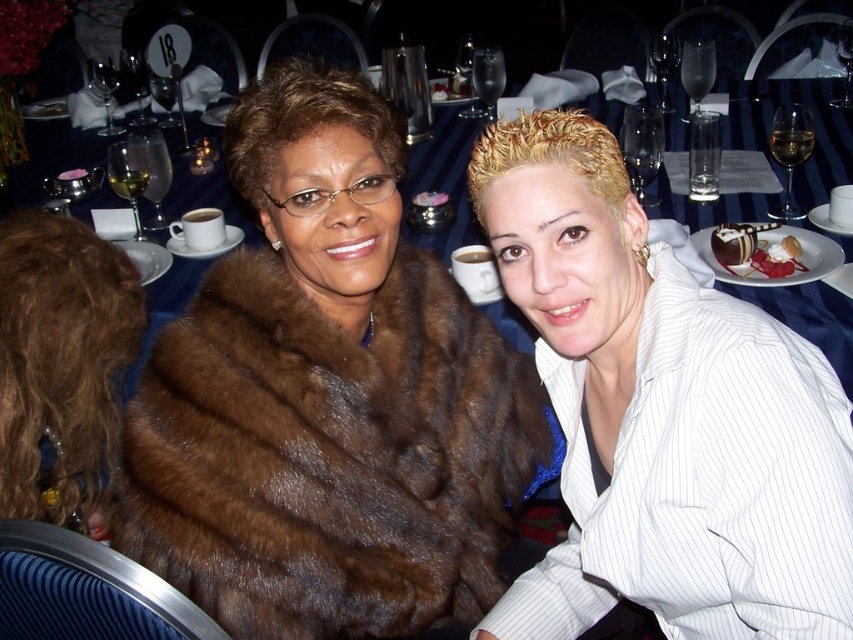
You are a photographer at the event and want to capture a photo that includes both the point at (711,248) and the point at (468,83). Which point should you focus on first to ensure both are in focus?

You should focus on point (468,83) first because it is closer to the photographer than point (711,248), ensuring both points are within the depth of field.

You are a photographer at a formal event. You need to capture a photo of the brown fur coat at center and the blue fabric table at center. Which object is positioned lower in the image?

The brown fur coat at center is located below the blue fabric table at center, so it is positioned lower in the image.

You are a guest at this event and want to take a photo of the chocolate glazed cake at right. Where should you position yourself to capture it in the frame?

To capture the chocolate glazed cake at right in your photo, position yourself near the area corresponding to coordinates point (x=753, y=250).